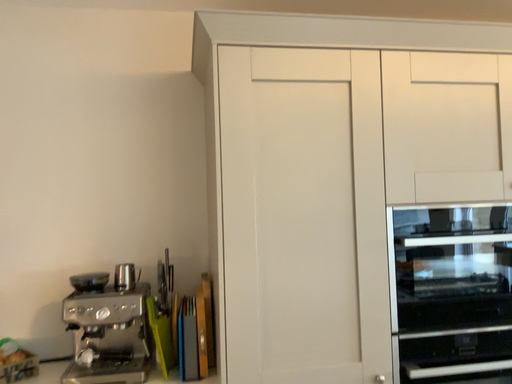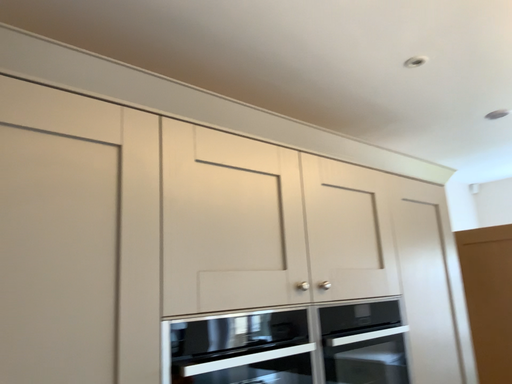
Question: How did the camera likely rotate when shooting the video?

Choices:
 (A) rotated left
 (B) rotated right

Answer: (B)